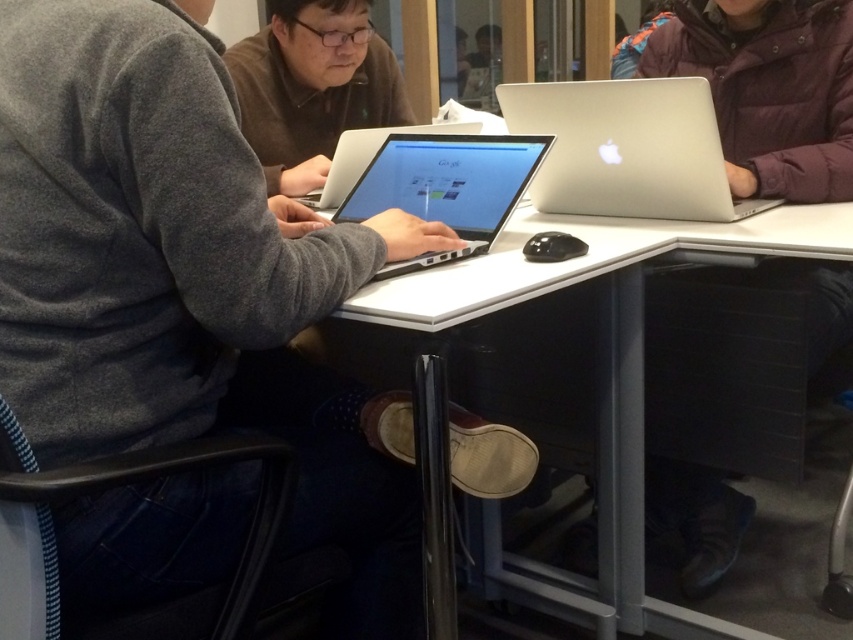
Which is more to the right, white glossy table at center or matte black laptop at center?

white glossy table at center

Which is in front, point (799, 244) or point (271, 100)?

Point (799, 244) is in front.

Image resolution: width=853 pixels, height=640 pixels. Identify the location of white glossy table at center. (608, 353).

Can you confirm if matte black laptop at center is taller than sleek silver laptop at center?

Correct, matte black laptop at center is much taller as sleek silver laptop at center.

Does matte black laptop at center have a larger size compared to sleek silver laptop at center?

Yes, matte black laptop at center is bigger than sleek silver laptop at center.

Between point (299, 49) and point (351, 179), which one is positioned behind?

Point (299, 49)

I want to click on matte black laptop at center, so coord(312,88).

Can you confirm if white glossy table at center is thinner than sleek silver laptop at center?

No.

Does white glossy table at center have a greater width compared to sleek silver laptop at center?

Indeed, white glossy table at center has a greater width compared to sleek silver laptop at center.

Who is more distant from viewer, (477, 298) or (473, 124)?

The point (473, 124) is more distant.

Where is `white glossy table at center`? white glossy table at center is located at coordinates (608, 353).